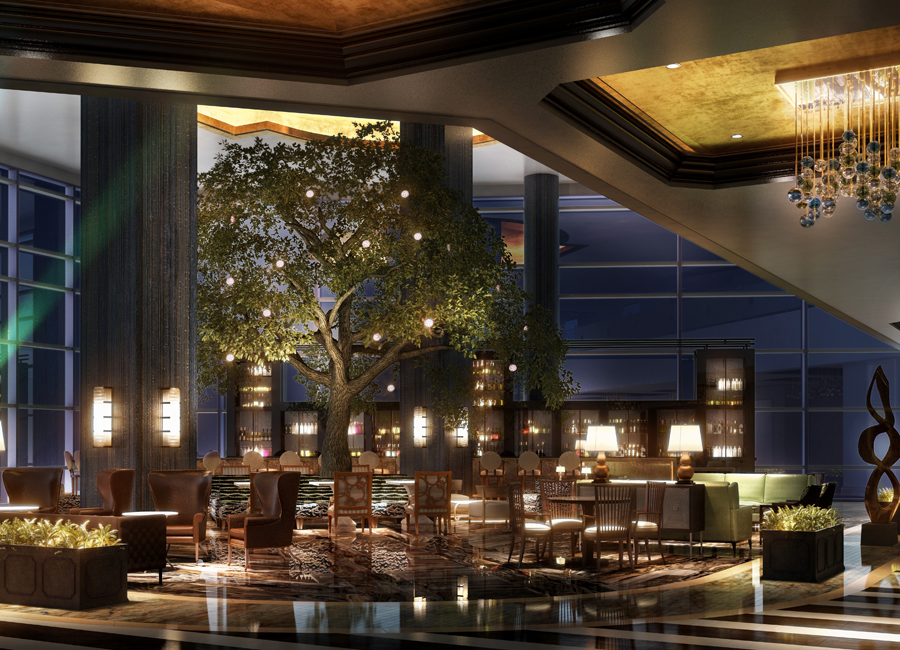
This screenshot has height=650, width=900. I want to click on sculpture, so click(886, 513).